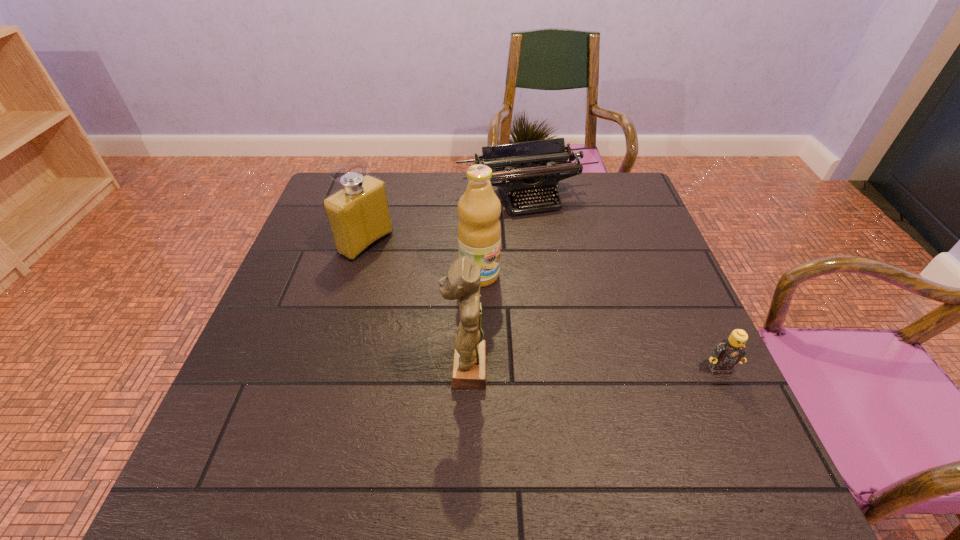
Where is `vacant space situated on the label of the olive oil`? vacant space situated on the label of the olive oil is located at coordinates (581, 349).

Image resolution: width=960 pixels, height=540 pixels. Identify the location of object at the far edge. (x=548, y=159).

Identify the location of object that is at the left edge. The image size is (960, 540). (358, 214).

Identify the location of Lego that is positioned at the right edge. (729, 352).

At what (x,y) coordinates should I click in order to perform the action: click on typewriter located at the right edge. Please return your answer as a coordinate pair (x, y). The height and width of the screenshot is (540, 960). Looking at the image, I should click on (548, 159).

Where is `object present at the far right corner`? object present at the far right corner is located at coordinates (548, 159).

Locate an element on the screen. The width and height of the screenshot is (960, 540). vacant space at the far edge is located at coordinates (437, 180).

Locate an element on the screen. This screenshot has width=960, height=540. vacant space at the near edge is located at coordinates (596, 410).

You are a GUI agent. You are given a task and a screenshot of the screen. Output one action in this format:
    pyautogui.click(x=<x>, y=<y>)
    Task: Click on the free region at the left edge
    
    Given the screenshot: What is the action you would take?
    pyautogui.click(x=272, y=375)

Image resolution: width=960 pixels, height=540 pixels. In the image, there is a desktop. What are the coordinates of `blank space at the right edge` in the screenshot? It's located at (631, 333).